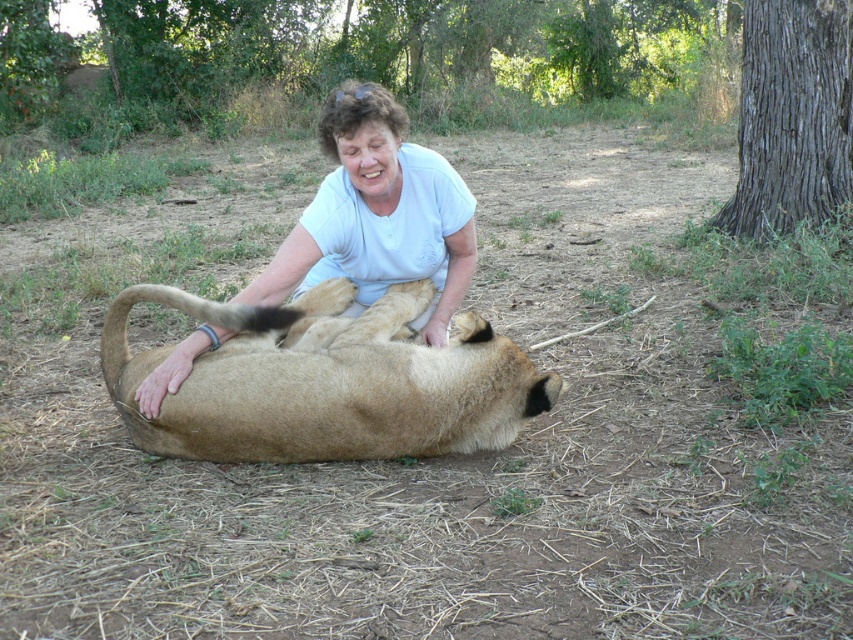
You are a wildlife photographer standing at the camera position. You want to capture a closeup shot of the golden fur lion at center. Given that your camera has a minimum focusing distance of 3 meters, will you be able to take the photo without moving closer?

The distance between the golden fur lion at center and the camera is 2.90 meters, which is less than the camera minimum focusing distance of 3 meters. Therefore, you cannot take the closeup shot without moving further away or adjusting the camera settings.

What is located at the coordinates point (328, 381) in the image?

At point (328, 381) lies golden fur lion at center.

You are a photographer standing at the edge of the scene. You want to take a photo focusing on the golden fur lion at center and the white smooth shirt at center. Which object should you adjust your camera focus to first to ensure both are in the frame?

The golden fur lion at center is closer to the viewer than the white smooth shirt at center, so you should focus on the golden fur lion at center first to ensure both are in the frame.